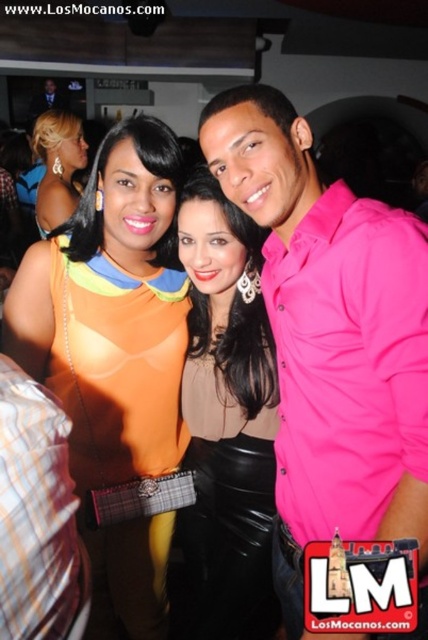
Who is taller, pink satin shirt at right or matte black skirt at center?

With more height is matte black skirt at center.

At what (x,y) coordinates should I click in order to perform the action: click on pink satin shirt at right. Please return your answer as a coordinate pair (x, y). The image size is (428, 640). Looking at the image, I should click on (347, 362).

The height and width of the screenshot is (640, 428). What do you see at coordinates (347, 362) in the screenshot?
I see `pink satin shirt at right` at bounding box center [347, 362].

You are a GUI agent. You are given a task and a screenshot of the screen. Output one action in this format:
    pyautogui.click(x=<x>, y=<y>)
    Task: Click on the pink satin shirt at right
    
    Given the screenshot: What is the action you would take?
    pyautogui.click(x=347, y=362)

Does point (422, 284) come closer to viewer compared to point (30, 388)?

No, it is behind (30, 388).

Who is positioned more to the left, pink satin shirt at right or plaid fabric shirt at left?

From the viewer's perspective, plaid fabric shirt at left appears more on the left side.

Does point (365, 467) lie behind point (8, 520)?

Yes, it is.

Where is `pink satin shirt at right`? pink satin shirt at right is located at coordinates (347, 362).

Who is positioned more to the right, pink matte shirt at center or orange fabric dress at center?

From the viewer's perspective, pink matte shirt at center appears more on the right side.

Who is positioned more to the left, pink matte shirt at center or orange fabric dress at center?

orange fabric dress at center

Which is in front, point (326, 481) or point (9, 349)?

Point (326, 481)

Locate an element on the screen. pink matte shirt at center is located at coordinates (332, 339).